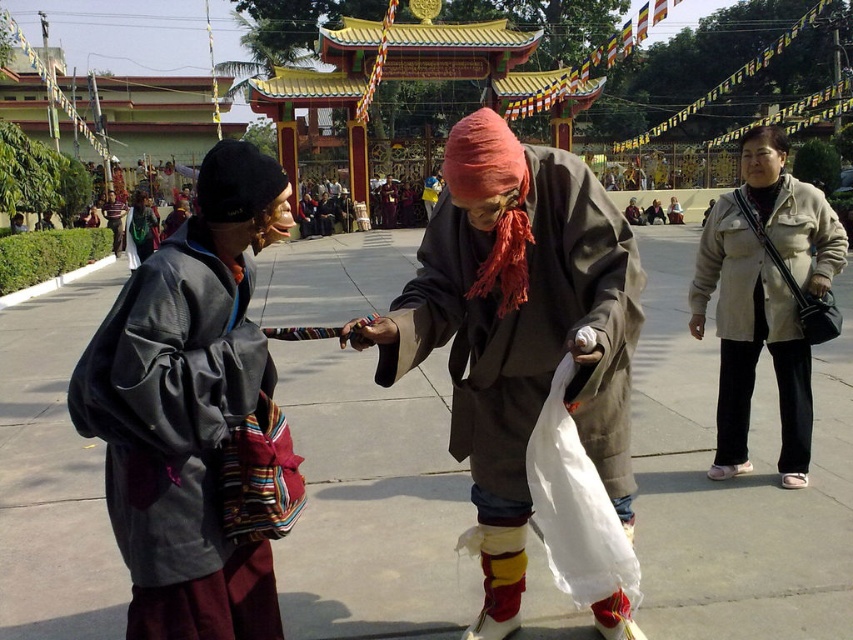
You are an observer standing in front of the temple scene. You notice two jackets in the image. Which jacket is closer to you, the matte black jacket at center or the matte gray jacket at left?

The matte black jacket at center is closer to you because it is in front of the matte gray jacket at left.

You are an observer standing in front of the temple scene. You notice the matte brown robe at center and the matte gray jacket at left. Which clothing item is shorter in height?

The matte brown robe at center is shorter than the matte gray jacket at left.